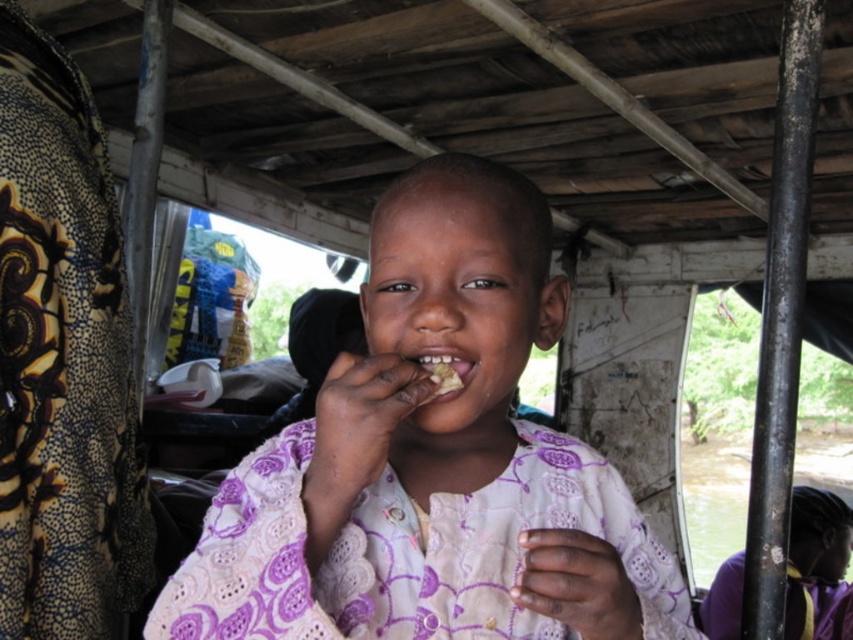
The child is sitting in a wooden boat. There is yellowish matte food at center and white crumbly food at mouth. Which food item is taller?

The yellowish matte food at center is taller than the white crumbly food at mouth.

You are a parent trying to decide which food to give your child first. The yellowish matte food at center is on the table, and the white crumbly food at mouth is already in their hand. Which food item is wider?

The yellowish matte food at center is wider than the white crumbly food at mouth.